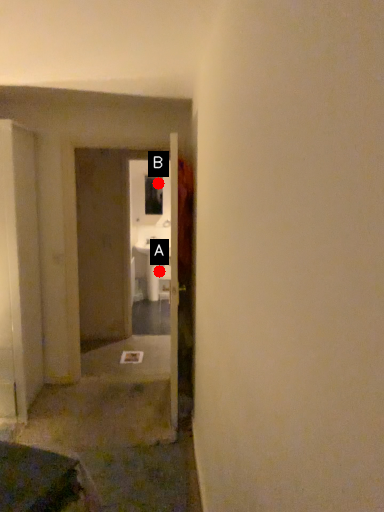
Question: Two points are circled on the image, labeled by A and B beside each circle. Which of the following is the closest to the observer?

Choices:
 (A) A is closer
 (B) B is closer

Answer: (A)